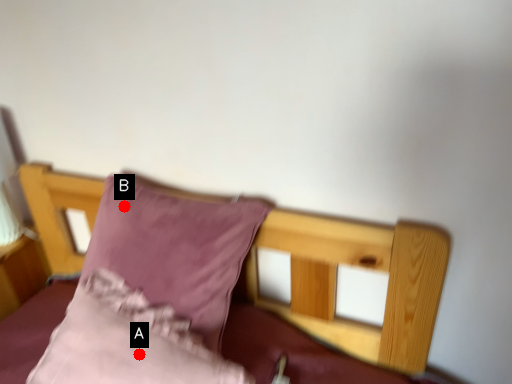
Question: Two points are circled on the image, labeled by A and B beside each circle. Which point is closer to the camera taking this photo?

Choices:
 (A) A is closer
 (B) B is closer

Answer: (A)